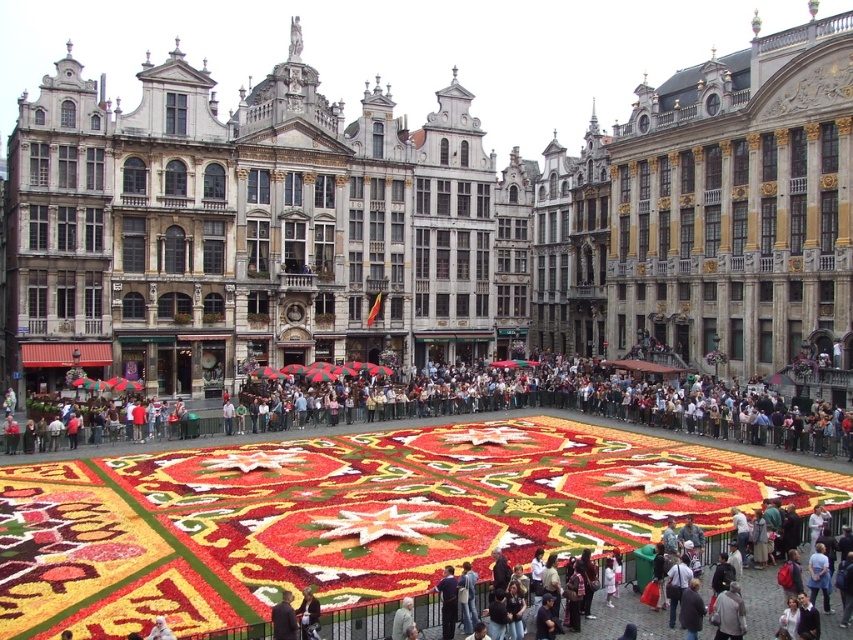
You are standing at the Grand Place in Brussels and see the stone building at center and the dark gray jacket at lower center. Which object is located to the left of the other?

The stone building at center is positioned on the left side of dark gray jacket at lower center, so the stone building at center is to the left of the dark gray jacket at lower center.

You are standing at the edge of the Grand Place in Brussels and see the point marked at coordinates (566, 403) which is in the multicolored fabric crowd at center. If you want to move towards that point, which direction should you walk?

The point marked at coordinates (566, 403) is located at the multicolored fabric crowd at center. Since you are at the edge, you should walk towards the center to reach that point.